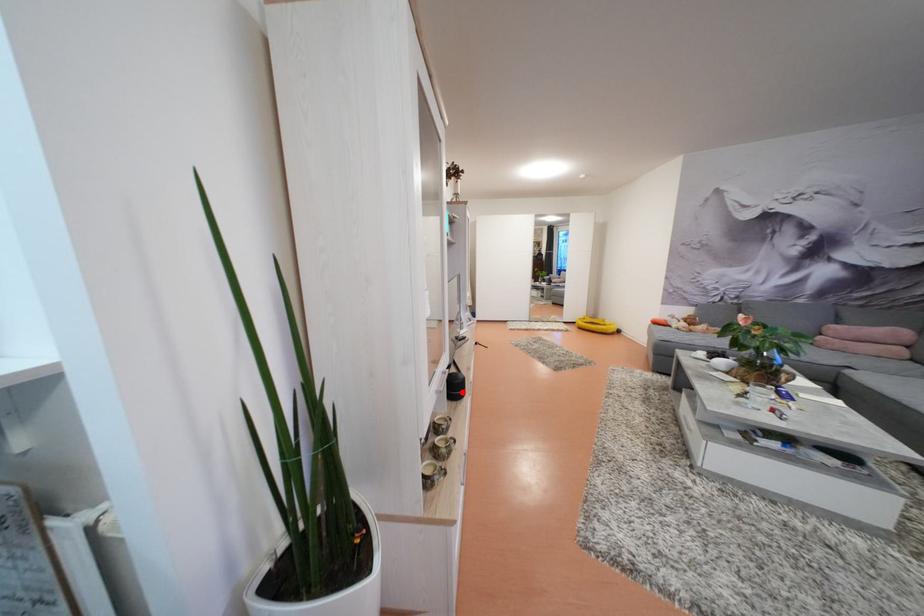
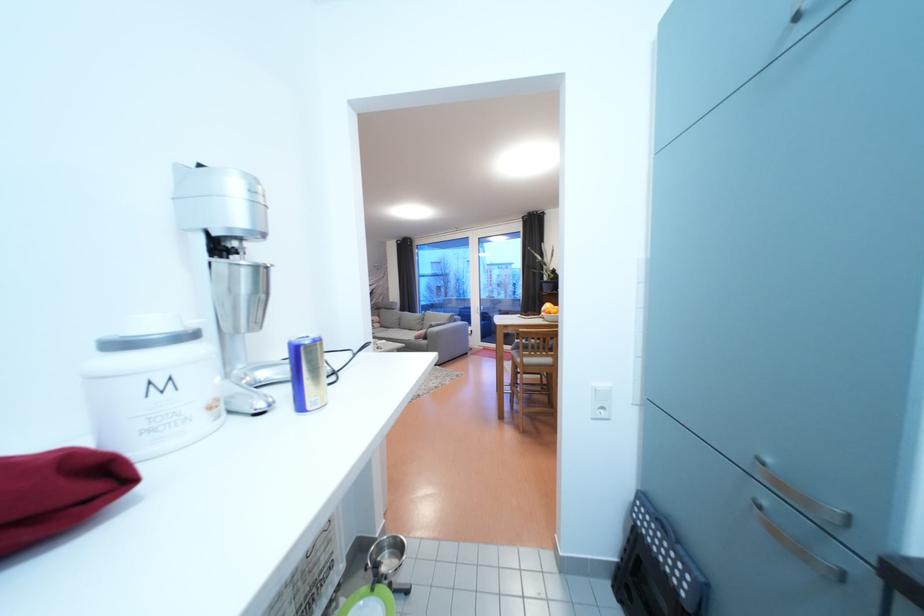
Question: I am providing you with two images of the same scene from different viewpoints. A red point is marked on the first image. Is the red point's position out of view in image 2?

Choices:
 (A) Yes
 (B) No

Answer: (A)